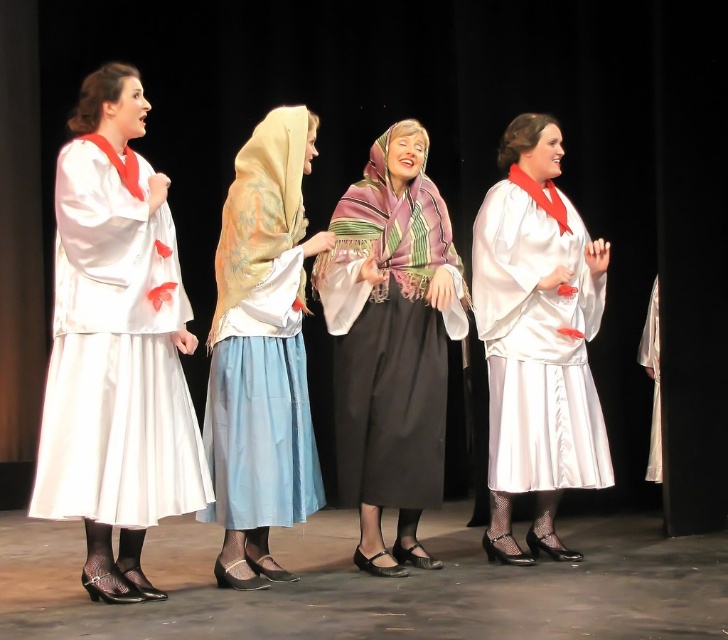
Is multicolored woven scarf at center positioned in front of satin white dress at center?

Yes, multicolored woven scarf at center is closer to the viewer.

Which of these two, multicolored woven scarf at center or satin white dress at center, stands shorter?

With less height is multicolored woven scarf at center.

The height and width of the screenshot is (640, 728). Find the location of `multicolored woven scarf at center`. multicolored woven scarf at center is located at coordinates (391, 342).

Who is positioned more to the left, multicolored woven scarf at center or silky beige scarf at center?

From the viewer's perspective, silky beige scarf at center appears more on the left side.

Who is positioned more to the right, multicolored woven scarf at center or silky beige scarf at center?

Positioned to the right is multicolored woven scarf at center.

What do you see at coordinates (391, 342) in the screenshot?
I see `multicolored woven scarf at center` at bounding box center [391, 342].

Where is `multicolored woven scarf at center`? multicolored woven scarf at center is located at coordinates (391, 342).

Which is behind, point (127, 332) or point (510, 406)?

The point (510, 406) is more distant.

Is point (132, 154) more distant than point (553, 317)?

No, (132, 154) is closer to viewer.

Where is `matte white dress at left`? The image size is (728, 640). matte white dress at left is located at coordinates click(116, 346).

Locate an element on the screen. matte white dress at left is located at coordinates (116, 346).